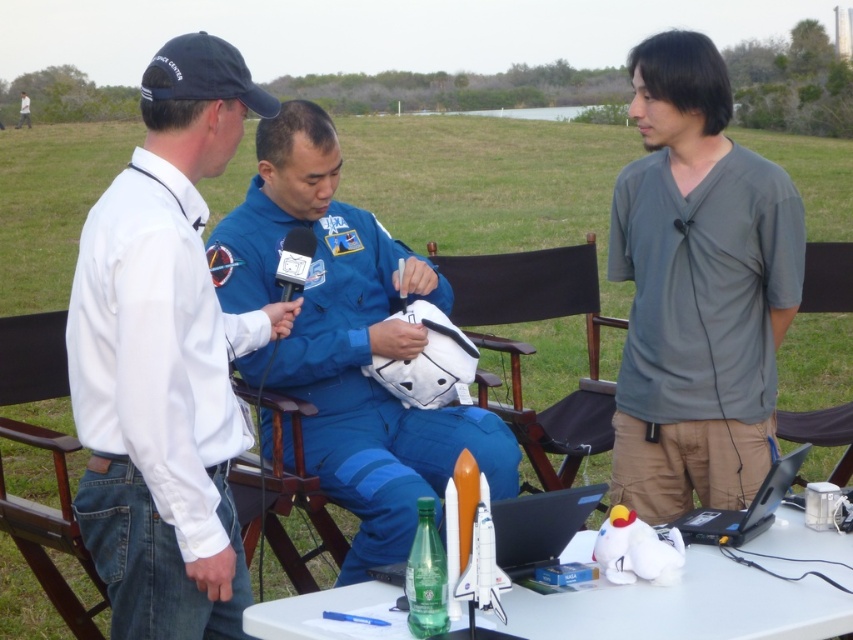
Question: Which object is positioned farthest from the white cotton shirt at left?

Choices:
 (A) black fabric chair at right
 (B) wooden chair at center
 (C) black plastic laptop at lower center

Answer: (A)

Question: Which point is closer to the camera taking this photo?

Choices:
 (A) (733, 321)
 (B) (503, 342)

Answer: (A)

Question: Can you confirm if blue fabric astronaut suit at center is bigger than wooden chair at center?

Choices:
 (A) yes
 (B) no

Answer: (A)

Question: Which object appears closest to the camera in this image?

Choices:
 (A) blue fabric astronaut suit at center
 (B) brown wood chair at left
 (C) black plastic laptop at lower center

Answer: (C)

Question: Is white cotton shirt at left wider than wooden chair at center?

Choices:
 (A) yes
 (B) no

Answer: (A)

Question: Is blue fabric astronaut suit at center thinner than black plastic laptop at lower center?

Choices:
 (A) yes
 (B) no

Answer: (B)